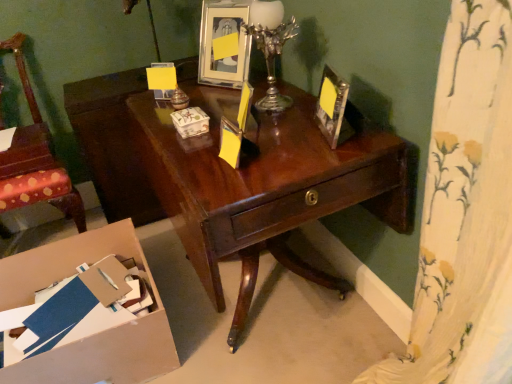
Find the location of a particular element. free spot in front of metallic silver picture frame at upper right, the second picture frame positioned from the back is located at coordinates (340, 153).